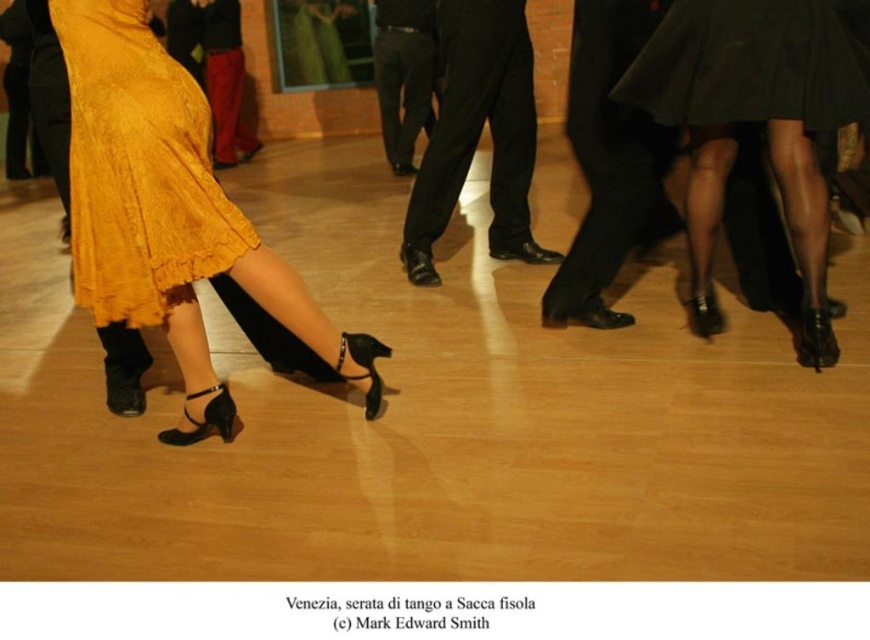
In the image of the tango event at Sacca Fisola, there is a mustard yellow fabric skirt at lower left and a point marked at coordinates (x=138, y=168). What does this point indicate?

The point at coordinates (x=138, y=168) marks the mustard yellow fabric skirt at lower left.

You are a photographer at Sacca Fisola in Venice, capturing the tango event. You notice the black leather pants at center and want to ensure they are in the frame. Given their coordinates at point 0.209, 0.551, can you confirm if they are positioned within the central focus area of your camera, which is set to capture from 0.1 to 0.3 on the horizontal axis and 0.4 to 0.6 on the vertical axis?

The black leather pants at center are located at coordinates 0.209 on the horizontal axis and 0.551 on the vertical axis. Since the horizontal coordinate 0.209 falls within the camera focus range of 0.1 to 0.3 and the vertical coordinate 0.551 is within 0.4 to 0.6, the black leather pants at center are indeed positioned within the central focus area of the camera.

You are a photographer at the tango event and want to capture a photo of the matte yellow dress at left and the black smooth pants at center. Which object is located more to the left in the image?

The matte yellow dress at left is more to the left than the black smooth pants at center.